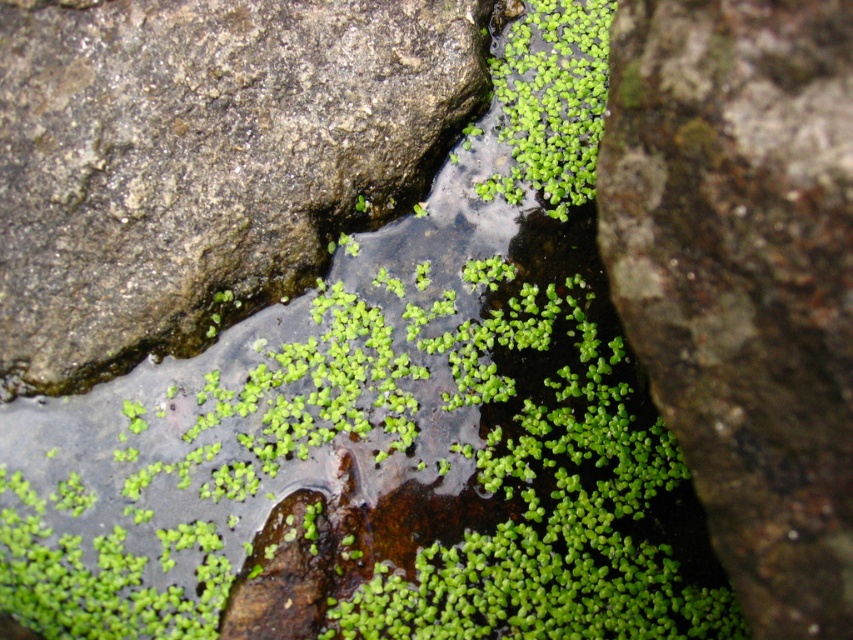
Question: Among these points, which one is farthest from the camera?

Choices:
 (A) (525, 44)
 (B) (292, 124)
 (C) (844, 336)

Answer: (A)

Question: Does green mossy rock at center lie in front of green leafy plant at upper center?

Choices:
 (A) yes
 (B) no

Answer: (A)

Question: Which point is closer to the camera taking this photo?

Choices:
 (A) (74, 246)
 (B) (538, 56)

Answer: (A)

Question: From the image, what is the correct spatial relationship of green mossy rock at center in relation to green leafy plant at upper center?

Choices:
 (A) above
 (B) below

Answer: (B)

Question: Considering the relative positions of gray rough rock at upper left and green leafy plant at upper center in the image provided, where is gray rough rock at upper left located with respect to green leafy plant at upper center?

Choices:
 (A) right
 (B) left

Answer: (B)

Question: Based on their relative distances, which object is nearer to the green leafy plant at upper center?

Choices:
 (A) gray rough rock at upper left
 (B) green mossy rock at center

Answer: (A)